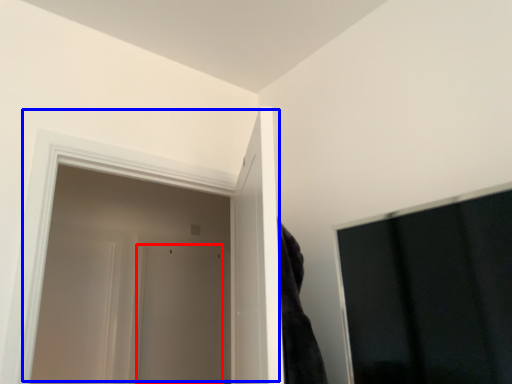
Question: Which point is further to the camera, door (highlighted by a red box) or door (highlighted by a blue box)?

Choices:
 (A) door
 (B) door

Answer: (A)